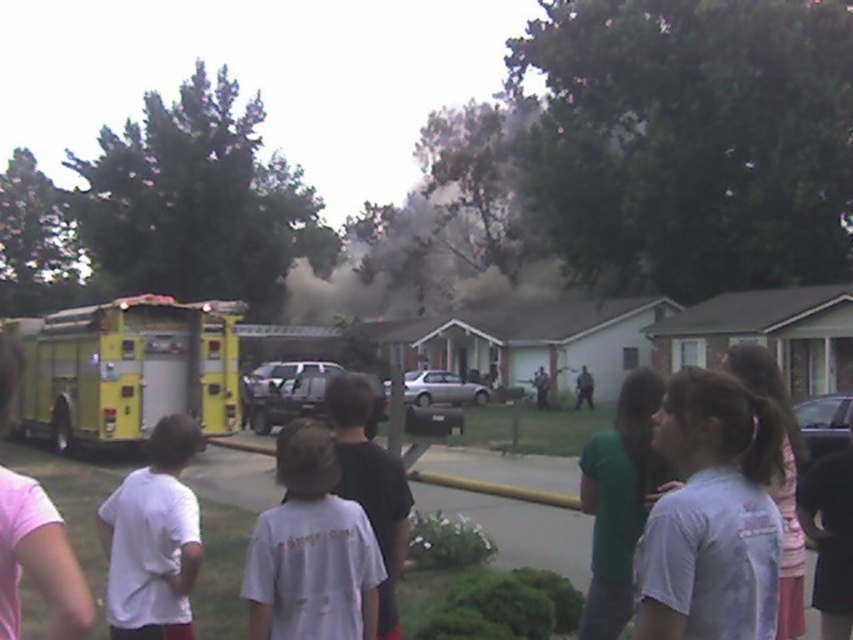
Does yellow metallic fire truck at left have a larger size compared to white cotton shirt at center?

Yes.

Does yellow metallic fire truck at left have a greater width compared to white cotton shirt at center?

Yes.

Based on the photo, who is more distant from viewer, (x=27, y=349) or (x=325, y=566)?

Point (x=27, y=349)

This screenshot has height=640, width=853. I want to click on yellow metallic fire truck at left, so click(126, 369).

Between black dust cloud at center and white cotton shirt at center, which one is positioned lower?

Positioned lower is white cotton shirt at center.

Is black dust cloud at center taller than white cotton shirt at center?

Yes, black dust cloud at center is taller than white cotton shirt at center.

Which is in front, point (514, 209) or point (361, 582)?

Positioned in front is point (361, 582).

Identify the location of black dust cloud at center. The height and width of the screenshot is (640, 853). (440, 228).

Between black dust cloud at center and yellow metallic fire truck at left, which one has more height?

black dust cloud at center is taller.

Between black dust cloud at center and yellow metallic fire truck at left, which one is positioned higher?

black dust cloud at center

Is point (399, 301) farther from viewer compared to point (57, 358)?

That is True.

Identify the location of black dust cloud at center. (440, 228).